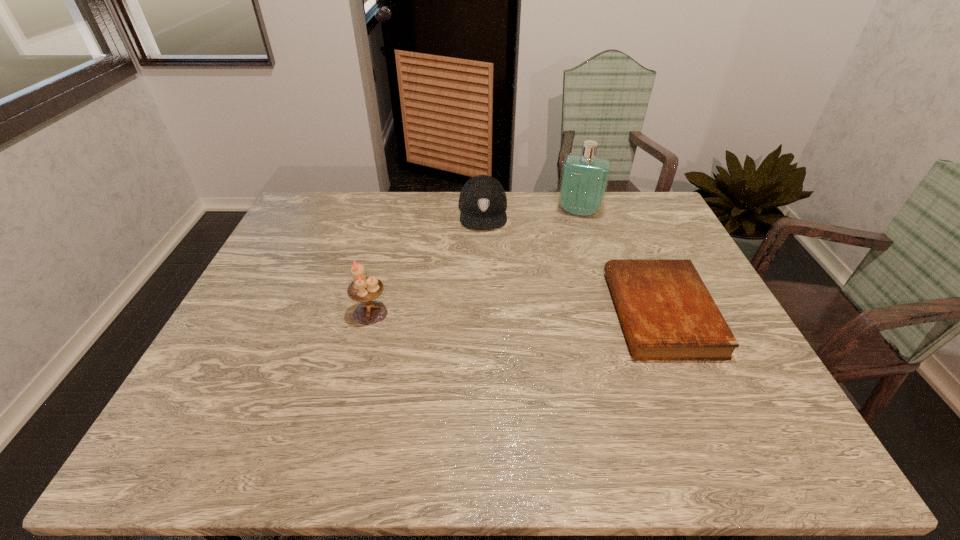
This screenshot has height=540, width=960. I want to click on vacant area located 0.260m on the front label of the perfume, so click(564, 268).

Image resolution: width=960 pixels, height=540 pixels. In order to click on vacant region located on the front label of the perfume in this screenshot , I will do [x=564, y=261].

Image resolution: width=960 pixels, height=540 pixels. Find the location of `free space located 0.300m on the front label of the perfume`. free space located 0.300m on the front label of the perfume is located at coordinates (562, 276).

The width and height of the screenshot is (960, 540). I want to click on free space located 0.230m on the front-facing side of the second object from left to right, so click(x=483, y=279).

This screenshot has height=540, width=960. Find the location of `blank space located on the front-facing side of the second object from left to right`. blank space located on the front-facing side of the second object from left to right is located at coordinates (483, 322).

You are a GUI agent. You are given a task and a screenshot of the screen. Output one action in this format:
    pyautogui.click(x=<x>, y=<y>)
    Task: Click on the vacant space located on the front-facing side of the second object from left to right
    The width and height of the screenshot is (960, 540).
    Given the screenshot: What is the action you would take?
    pyautogui.click(x=483, y=322)

Locate an element on the screen. This screenshot has width=960, height=540. perfume situated at the far edge is located at coordinates (584, 178).

Locate an element on the screen. Image resolution: width=960 pixels, height=540 pixels. cap that is at the far edge is located at coordinates (482, 201).

The width and height of the screenshot is (960, 540). In order to click on object at the right edge in this screenshot , I will do `click(667, 313)`.

In the image, there is a desktop. Identify the location of free space at the far edge. This screenshot has height=540, width=960. (541, 204).